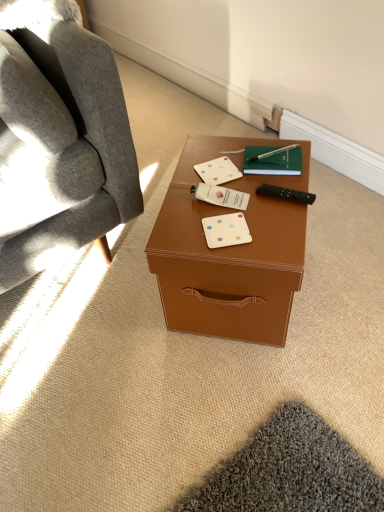
Image resolution: width=384 pixels, height=512 pixels. Find the location of `free space to the back side of white matte business card at center, which is counted as the first business card, starting from the bottom`. free space to the back side of white matte business card at center, which is counted as the first business card, starting from the bottom is located at coordinates (218, 188).